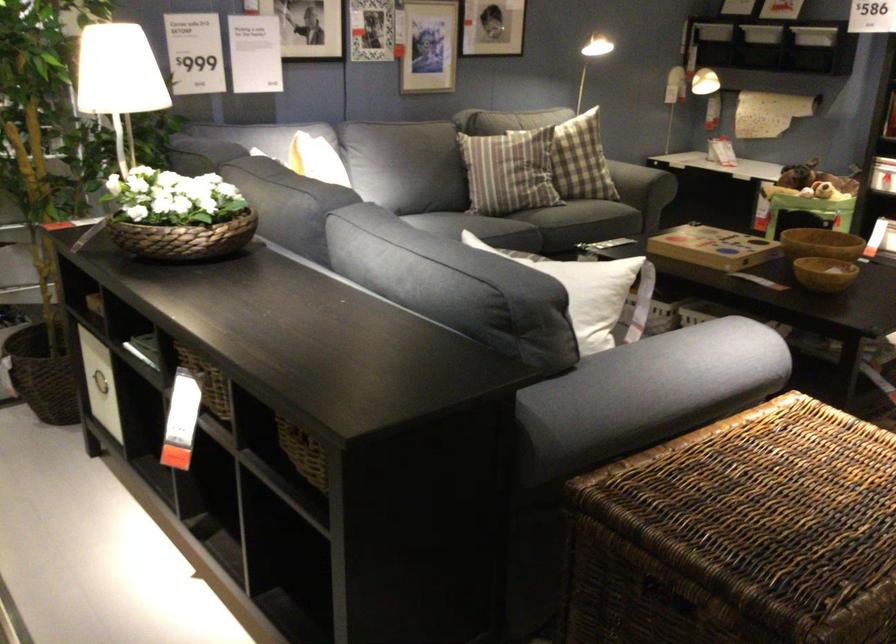
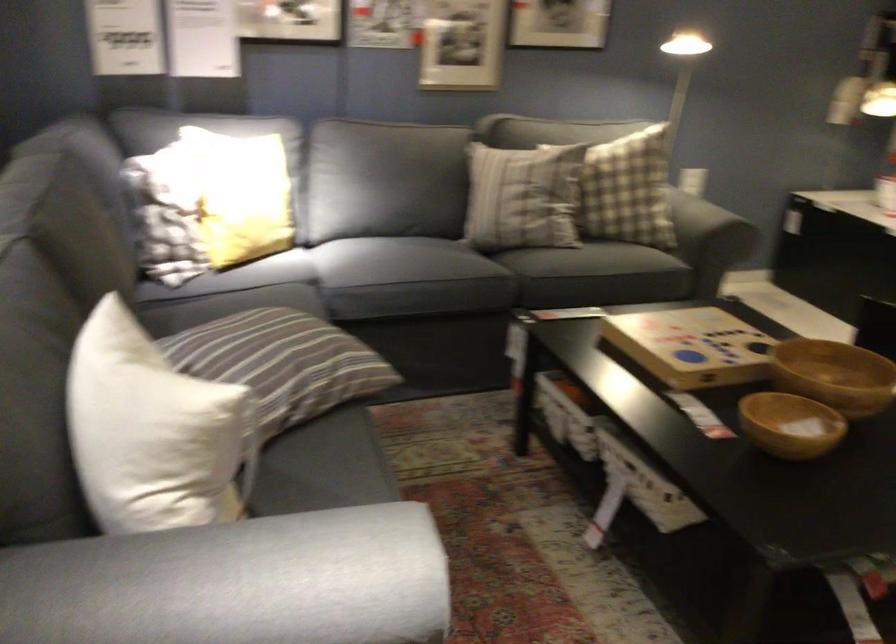
What movement of the cameraman would produce the second image?

The cameraman walked toward right, forward.